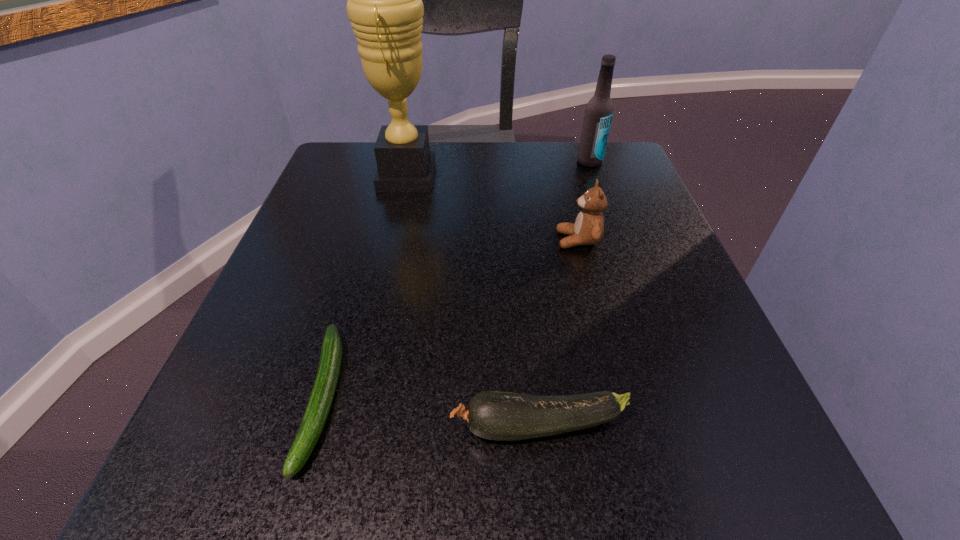
Identify the location of vacant space at the far left corner of the desktop. (383, 199).

You are a GUI agent. You are given a task and a screenshot of the screen. Output one action in this format:
    pyautogui.click(x=<x>, y=<y>)
    Task: Click on the free space at the far right corner of the desktop
    The image size is (960, 540).
    Given the screenshot: What is the action you would take?
    pyautogui.click(x=563, y=166)

The height and width of the screenshot is (540, 960). In the image, there is a desktop. In order to click on free region at the near right corner in this screenshot , I will do `click(728, 472)`.

In order to click on empty space that is in between the beer bottle and the trophy cup in this screenshot , I will do click(x=498, y=169).

The width and height of the screenshot is (960, 540). What are the coordinates of `empty location between the trophy cup and the third shortest object` in the screenshot? It's located at (492, 208).

Where is `vacant space in between the second tallest object and the tallest object`? This screenshot has height=540, width=960. vacant space in between the second tallest object and the tallest object is located at coordinates (498, 169).

The height and width of the screenshot is (540, 960). In order to click on free space between the tallest object and the right zucchini in this screenshot , I will do `click(473, 301)`.

Where is `free point between the left zucchini and the fourth tallest object`? This screenshot has height=540, width=960. free point between the left zucchini and the fourth tallest object is located at coordinates (431, 412).

At what (x,y) coordinates should I click in order to perform the action: click on vacant space that's between the trophy cup and the fourth shortest object. Please return your answer as a coordinate pair (x, y). The height and width of the screenshot is (540, 960). Looking at the image, I should click on (498, 169).

The width and height of the screenshot is (960, 540). Find the location of `vacant space that is in between the left zucchini and the right zucchini`. vacant space that is in between the left zucchini and the right zucchini is located at coordinates (431, 412).